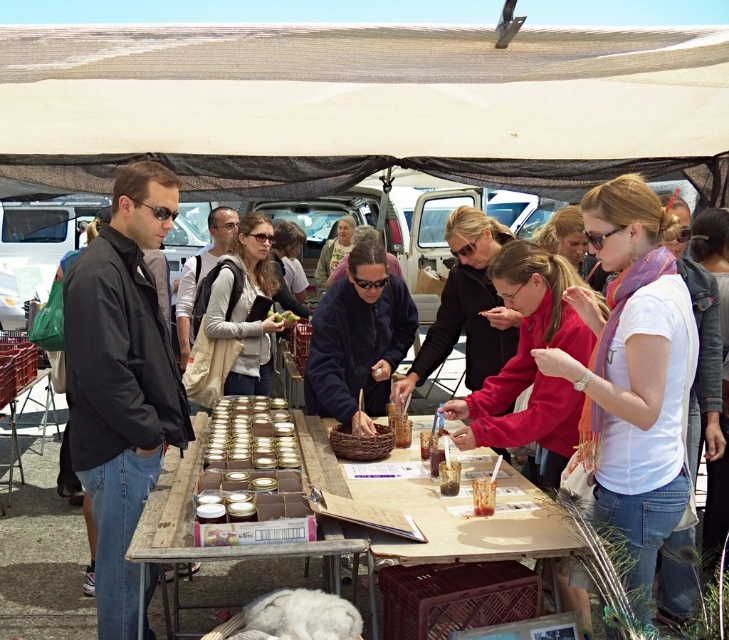
Consider the image. Which of these two, matte gray sweater at center or green matte vegetable at center, stands taller?

With more height is matte gray sweater at center.

Does matte gray sweater at center lie behind green matte vegetable at center?

That is False.

Find the location of a particular element. The image size is (729, 640). matte gray sweater at center is located at coordinates (243, 305).

From the picture: Which is above, white matte shirt at center or dark blue fleece at center?

dark blue fleece at center is above.

Between white matte shirt at center and dark blue fleece at center, which one has more height?

Standing taller between the two is white matte shirt at center.

Image resolution: width=729 pixels, height=640 pixels. In order to click on white matte shirt at center in this screenshot , I will do `click(634, 374)`.

Can you confirm if black matte jacket at left is smaller than dark blue fleece at center?

No.

Locate an element on the screen. This screenshot has height=640, width=729. black matte jacket at left is located at coordinates (120, 380).